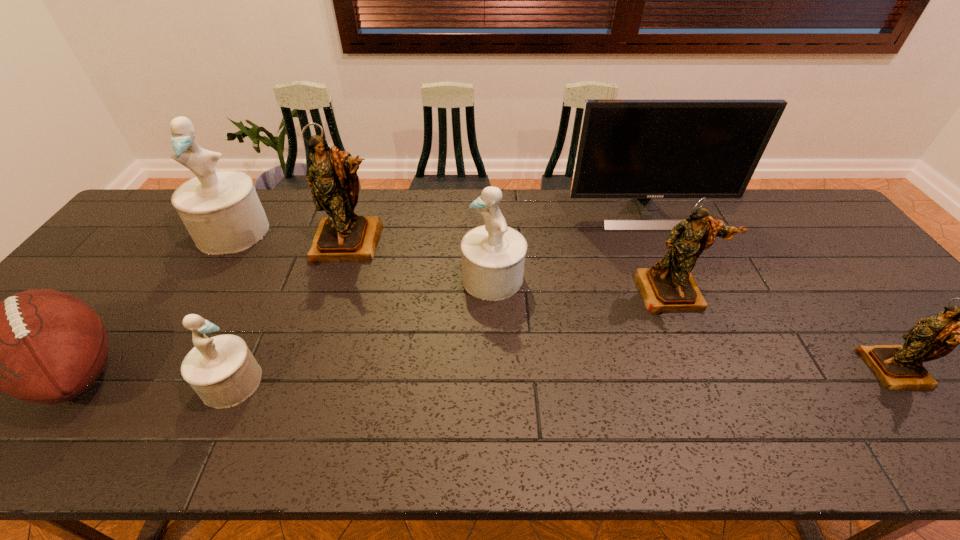
Identify the location of free space at the far right corner of the desktop. (788, 207).

Locate an element on the screen. The height and width of the screenshot is (540, 960). vacant area that lies between the biggest gold figurine and the leftmost figurine is located at coordinates (291, 237).

Where is `free point between the rightmost white figurine and the rightmost figurine`? free point between the rightmost white figurine and the rightmost figurine is located at coordinates (694, 324).

Identify the location of unoccupied position between the biggest white figurine and the monitor. (441, 223).

Image resolution: width=960 pixels, height=540 pixels. I want to click on vacant region between the second biggest gold figurine and the smallest gold figurine, so click(783, 331).

Where is `blank region between the smallest white figurine and the second nearest gold figurine`? The height and width of the screenshot is (540, 960). blank region between the smallest white figurine and the second nearest gold figurine is located at coordinates (452, 338).

Identify which object is the second nearest to the farthest gold figurine. Please provide its 2D coordinates. Your answer should be formatted as a tuple, i.e. [(x, y)], where the tuple contains the x and y coordinates of a point satisfying the conditions above.

[(492, 255)]

Select which object appears as the fifth closest to the second white figurine from right to left. Please provide its 2D coordinates. Your answer should be formatted as a tuple, i.e. [(x, y)], where the tuple contains the x and y coordinates of a point satisfying the conditions above.

[(642, 149)]

The height and width of the screenshot is (540, 960). In order to click on figurine that is the fifth closest one to the second smallest gold figurine in this screenshot , I will do `click(221, 210)`.

Where is `figurine object that ranks as the third closest to the nearest gold figurine`? The width and height of the screenshot is (960, 540). figurine object that ranks as the third closest to the nearest gold figurine is located at coordinates (x=343, y=236).